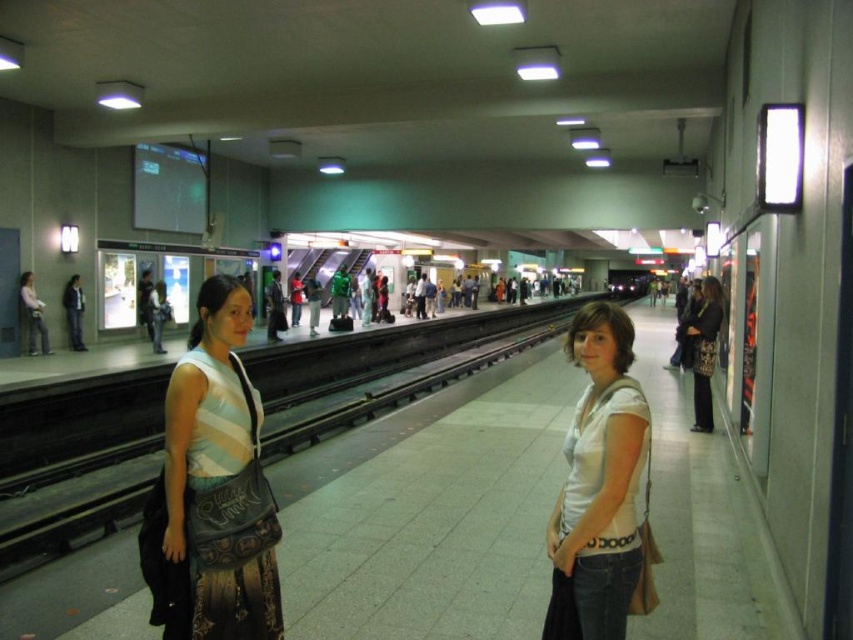
You are standing on the subway platform and see two points marked on the ground. The first point is at coordinates point (209, 428) and the second is at point (604, 476). Which point is closer to you?

Point (209, 428) is behind point (604, 476), so the point closer to you is point (604, 476).

Based on the photo, you are a photographer trying to capture a candid shot of the white cotton shirt at center without the matte black bag at left blocking the view. Based on their sizes, which object would you need to adjust your camera angle to avoid?

The matte black bag at left is larger in size than the white cotton shirt at center, so you would need to adjust your camera angle to avoid the matte black bag at left blocking the view.

You are a photographer standing on the subway platform. You want to take a photo of the matte black bag at left and the matte black jacket at center without any obstruction. Which object should you adjust your angle to ensure it is fully visible?

The matte black bag at left is positioned under the matte black jacket at center. To ensure the matte black bag at left is fully visible, you should adjust your angle to avoid the obstruction caused by the matte black jacket at center being in front of it.